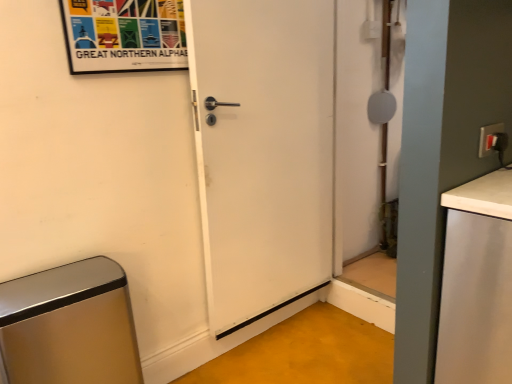
Question: Considering the positions of matte paper poster at upper left and white matte countertop at right in the image, is matte paper poster at upper left wider or thinner than white matte countertop at right?

Choices:
 (A) wide
 (B) thin

Answer: (B)

Question: In terms of size, does matte paper poster at upper left appear bigger or smaller than white matte countertop at right?

Choices:
 (A) big
 (B) small

Answer: (B)

Question: Considering the real-world distances, which object is closest to the white matte countertop at right?

Choices:
 (A) matte white screen door at right
 (B) metallic brushed trash can at lower left
 (C) matte white switch at upper right
 (D) matte paper poster at upper left
 (E) white matte door at center

Answer: (C)

Question: Which of these objects is positioned closest to the metallic brushed trash can at lower left?

Choices:
 (A) matte white screen door at right
 (B) white matte door at center
 (C) white matte countertop at right
 (D) matte white switch at upper right
 (E) matte paper poster at upper left

Answer: (B)